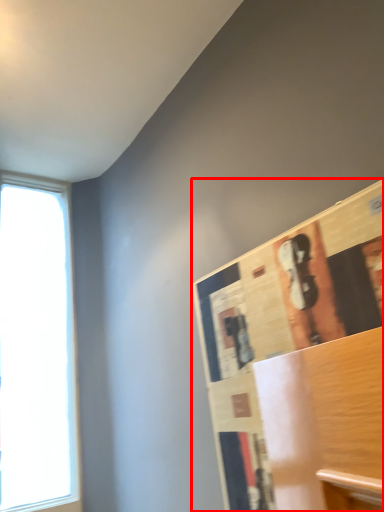
Question: From the image's perspective, where is bulletin board (annotated by the red box) located relative to window?

Choices:
 (A) below
 (B) above

Answer: (B)